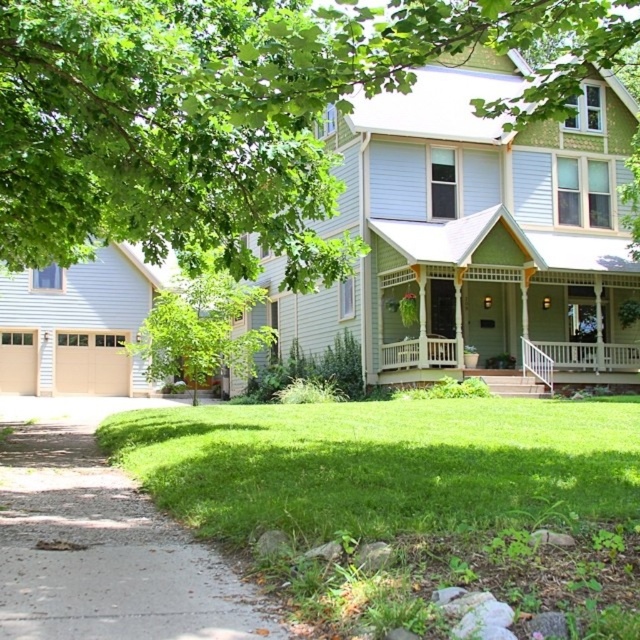
Does green leafy tree at center have a larger size compared to white wooden porch at center?

Correct, green leafy tree at center is larger in size than white wooden porch at center.

Can you confirm if green leafy tree at center is positioned above white wooden porch at center?

Yes, green leafy tree at center is above white wooden porch at center.

Locate an element on the screen. green leafy tree at center is located at coordinates (200, 330).

Does green leafy tree at upper left have a lesser width compared to gray concrete path at lower left?

No, green leafy tree at upper left is not thinner than gray concrete path at lower left.

Who is more forward, (291, 97) or (145, 563)?

Point (145, 563)

The width and height of the screenshot is (640, 640). I want to click on green leafy tree at upper left, so click(234, 115).

Between green leafy tree at upper left and green leafy tree at center, which one appears on the right side from the viewer's perspective?

green leafy tree at upper left is more to the right.

Is green leafy tree at upper left bigger than green leafy tree at center?

Yes, green leafy tree at upper left is bigger than green leafy tree at center.

Where is `green leafy tree at upper left`? green leafy tree at upper left is located at coordinates (234, 115).